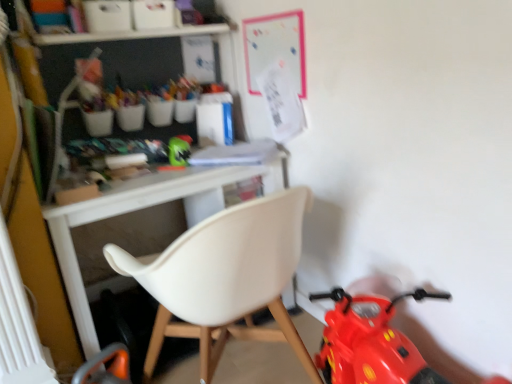
Question: Does white plastic radiator at lower left have a larger size compared to green matte helmet at center?

Choices:
 (A) no
 (B) yes

Answer: (B)

Question: Is the depth of white plastic radiator at lower left less than that of green matte helmet at center?

Choices:
 (A) no
 (B) yes

Answer: (B)

Question: Does white plastic radiator at lower left lie behind green matte helmet at center?

Choices:
 (A) no
 (B) yes

Answer: (A)

Question: Is white plastic radiator at lower left facing towards green matte helmet at center?

Choices:
 (A) no
 (B) yes

Answer: (A)

Question: Can you confirm if white plastic radiator at lower left is thinner than green matte helmet at center?

Choices:
 (A) no
 (B) yes

Answer: (B)

Question: Is white plastic radiator at lower left touching green matte helmet at center?

Choices:
 (A) no
 (B) yes

Answer: (A)

Question: From a real-world perspective, is green matte helmet at center located beneath white plastic radiator at lower left?

Choices:
 (A) yes
 (B) no

Answer: (B)

Question: Is green matte helmet at center with white plastic radiator at lower left?

Choices:
 (A) yes
 (B) no

Answer: (B)

Question: Is green matte helmet at center to the left of white plastic radiator at lower left from the viewer's perspective?

Choices:
 (A) yes
 (B) no

Answer: (B)

Question: From the image's perspective, is green matte helmet at center located above white plastic radiator at lower left?

Choices:
 (A) yes
 (B) no

Answer: (A)

Question: Is the depth of green matte helmet at center greater than that of white plastic radiator at lower left?

Choices:
 (A) yes
 (B) no

Answer: (A)

Question: Does green matte helmet at center appear on the right side of white plastic radiator at lower left?

Choices:
 (A) no
 (B) yes

Answer: (B)

Question: Is white plastic radiator at lower left in front of white plastic chair at center?

Choices:
 (A) no
 (B) yes

Answer: (A)